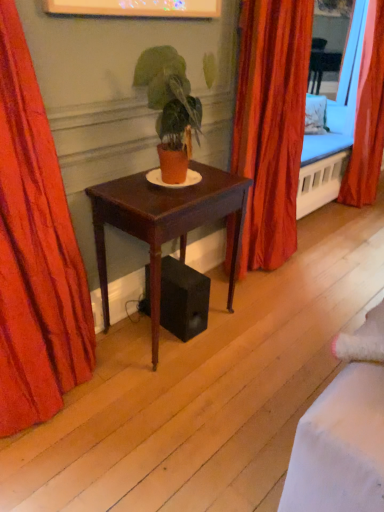
At what (x,y) coordinates should I click in order to perform the action: click on vacant space that's between velvet red curtain at left, the first curtain in the left-to-right sequence, and mahogany wood desk at center. Please return your answer as a coordinate pair (x, y). Looking at the image, I should click on (110, 374).